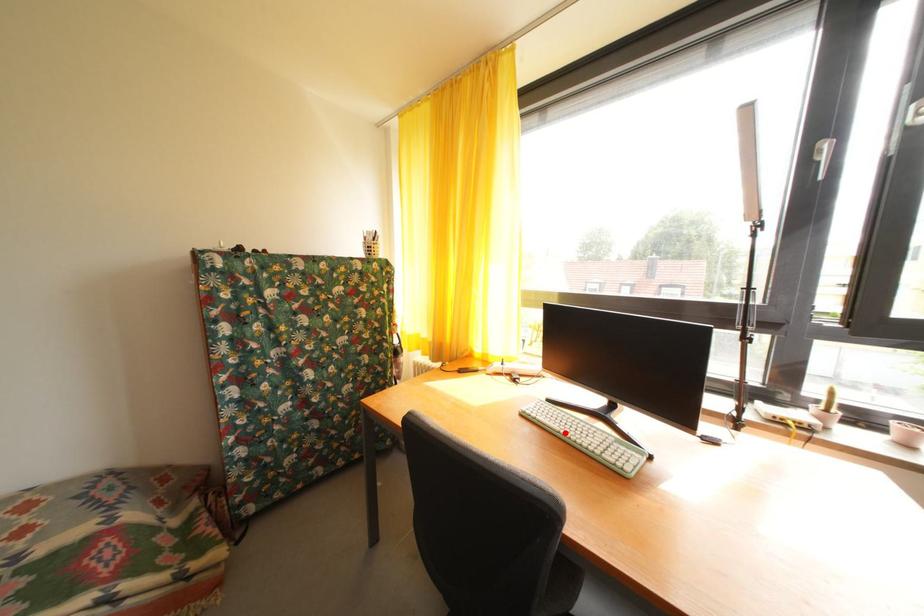
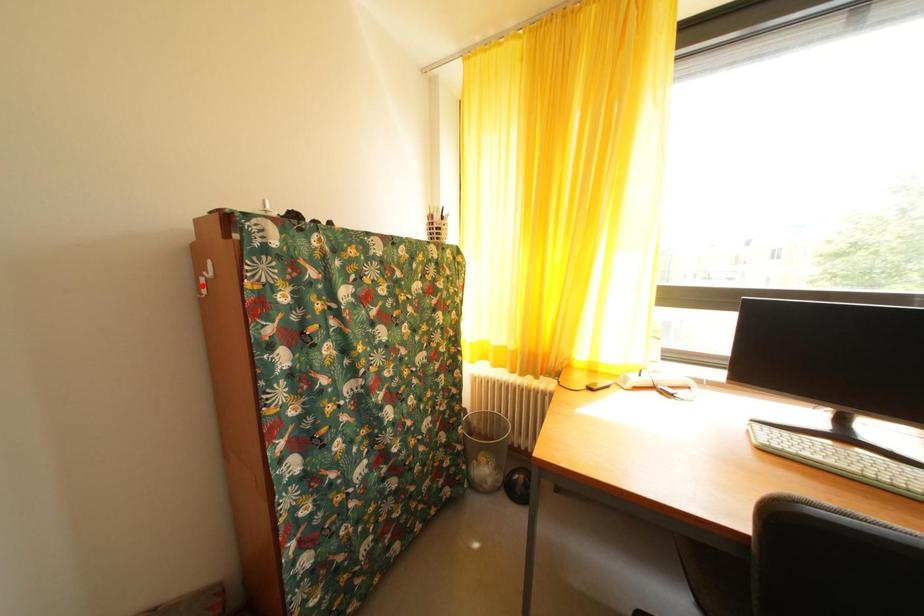
I am providing you with two images of the same scene from different viewpoints. A red point is marked on the first image and another point is marked on the second image. Does the point marked in image1 correspond to the same location as the one in image2?

No